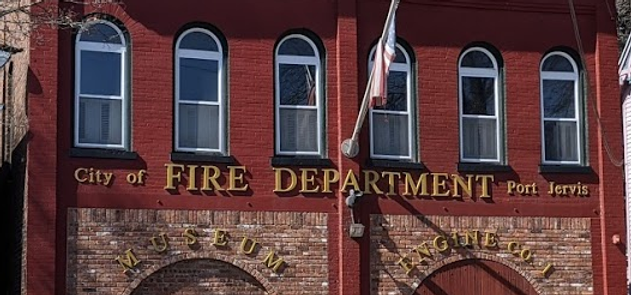
Identify the location of window. Image resolution: width=631 pixels, height=295 pixels. (102, 76), (192, 86), (305, 86), (392, 88), (474, 97), (565, 92).